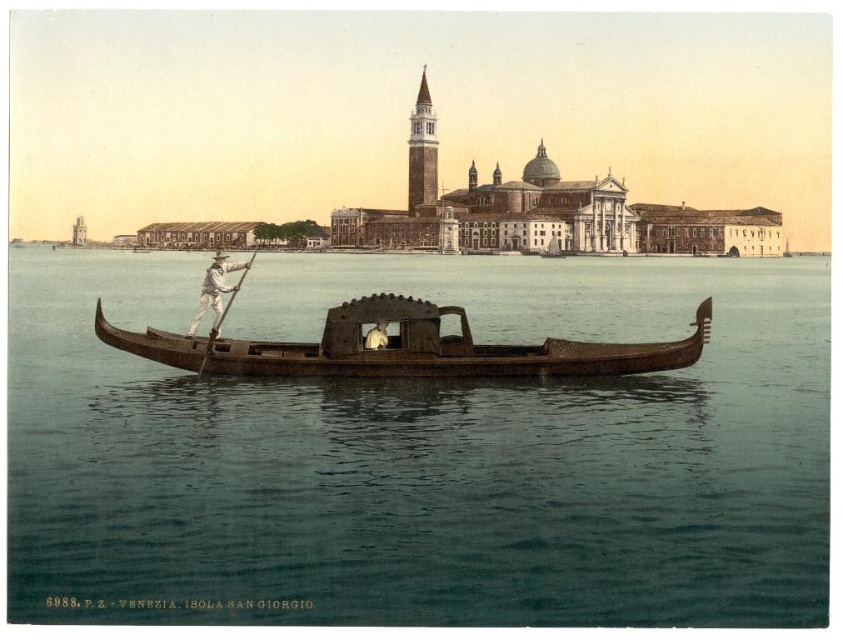
Question: Among these objects, which one is nearest to the camera?

Choices:
 (A) wooden canoe at center
 (B) brown stone bell tower at upper center

Answer: (A)

Question: Can you confirm if wooden canoe at center is wider than brown stone bell tower at upper center?

Choices:
 (A) yes
 (B) no

Answer: (A)

Question: Which point is farther to the camera?

Choices:
 (A) (600, 397)
 (B) (710, 316)
 (C) (423, 179)

Answer: (C)

Question: Considering the relative positions of wooden canoe at center and brown stone bell tower at upper center in the image provided, where is wooden canoe at center located with respect to brown stone bell tower at upper center?

Choices:
 (A) right
 (B) left

Answer: (B)

Question: Does clear water at center have a smaller size compared to brown stone bell tower at upper center?

Choices:
 (A) yes
 (B) no

Answer: (B)

Question: Considering the real-world distances, which object is farthest from the brown stone bell tower at upper center?

Choices:
 (A) wooden canoe at center
 (B) clear water at center

Answer: (A)